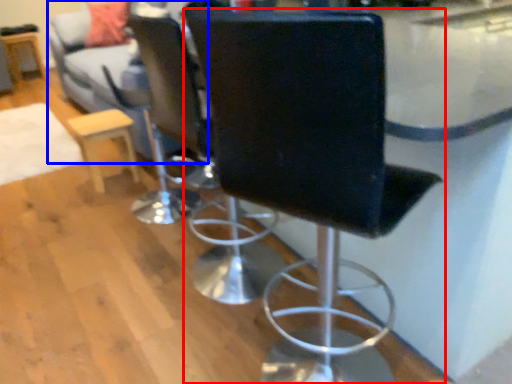
Question: Which of the following is the farthest to the observer, chair (highlighted by a red box) or couch (highlighted by a blue box)?

Choices:
 (A) chair
 (B) couch

Answer: (B)